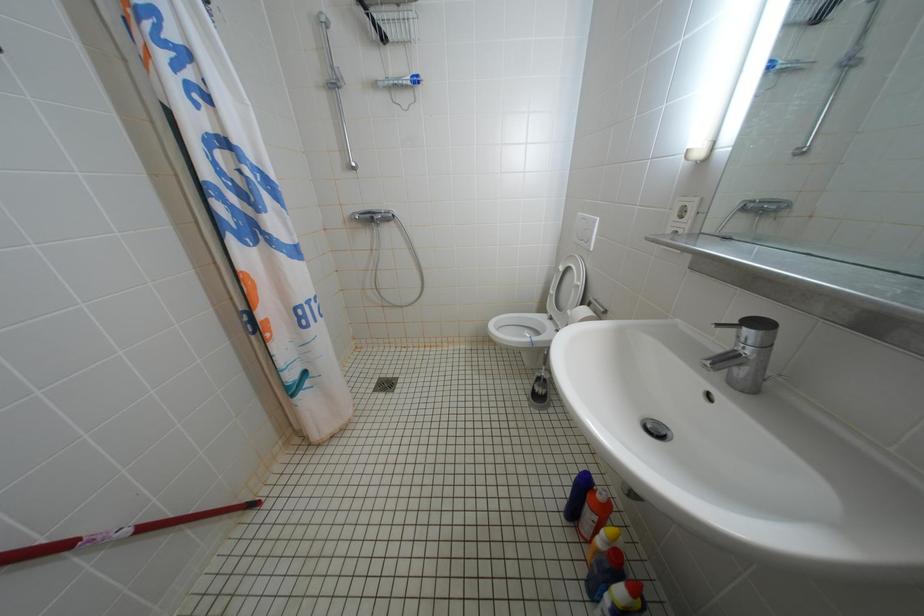
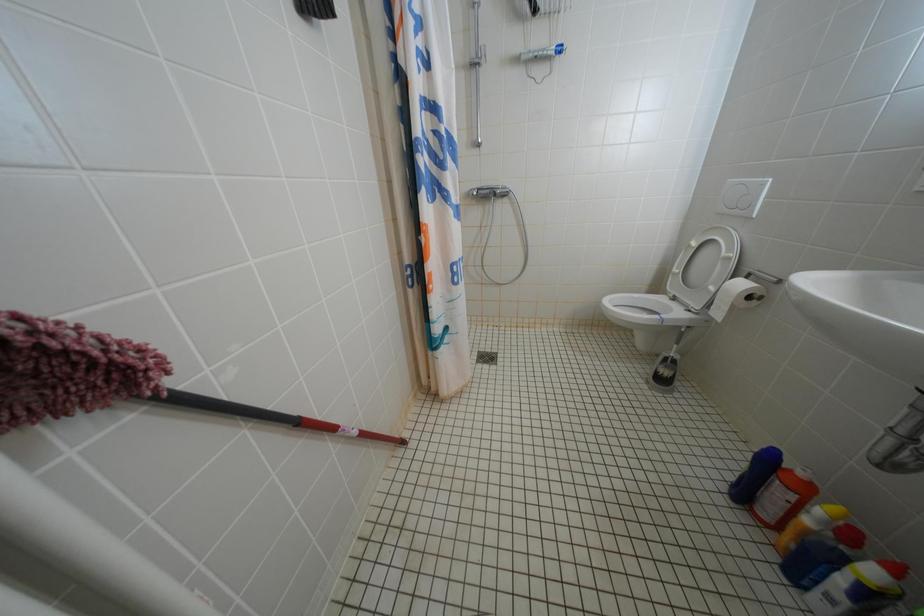
Question: Which direction would the cameraman need to move to produce the second image? Reply with the corresponding letter.

Choices:
 (A) Left
 (B) Right
 (C) Forward
 (D) Backward

Answer: (A)